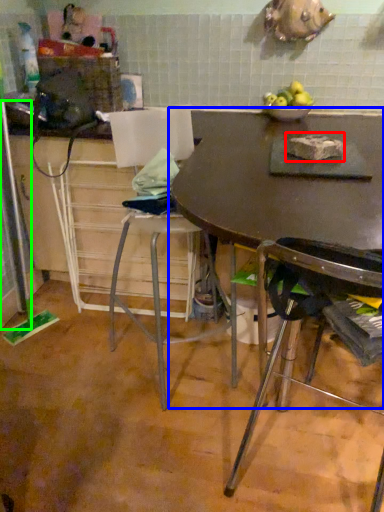
Question: Which object is positioned closest to food (highlighted by a red box)? Select from table (highlighted by a blue box) and screen door (highlighted by a green box).

Choices:
 (A) table
 (B) screen door

Answer: (A)